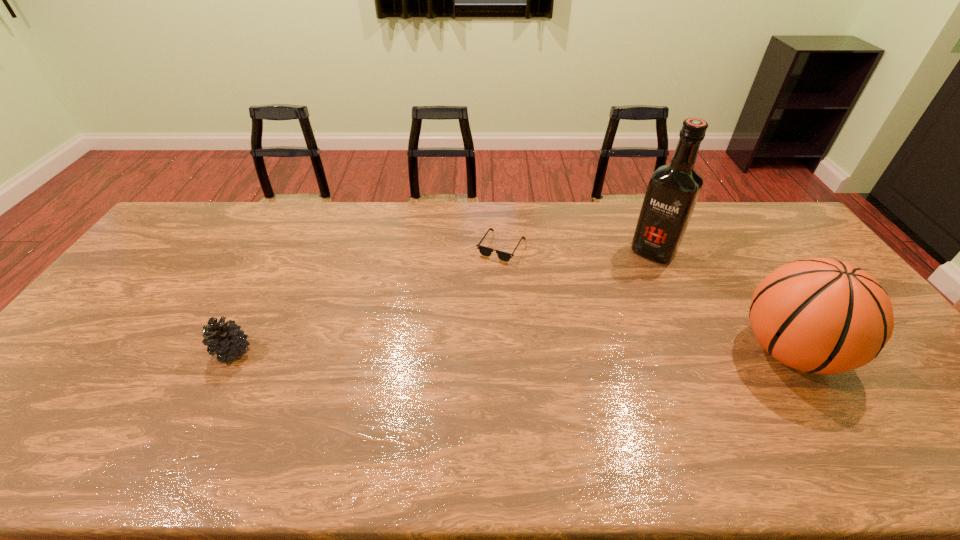
What are the coordinates of `free space on the desktop that is between the leftmost object and the rightmost object and is positioned on the front-facing side of the liquor` in the screenshot? It's located at (579, 351).

Image resolution: width=960 pixels, height=540 pixels. I want to click on vacant space on the desktop that is between the pinecone and the second tallest object and is positioned on the lenses of the sunglasses, so click(517, 351).